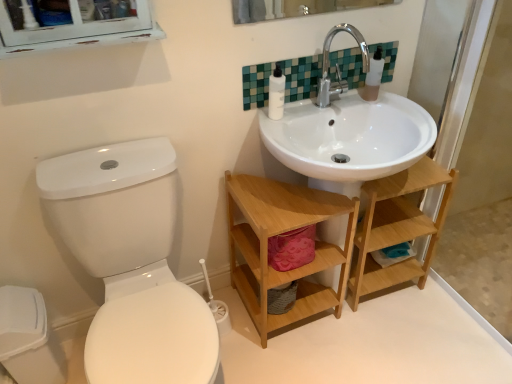
Question: From the image's perspective, would you say silver metallic faucet at upper center is shown under transparent plastic soap dispenser at upper right?

Choices:
 (A) yes
 (B) no

Answer: (A)

Question: Is silver metallic faucet at upper center bigger than transparent plastic soap dispenser at upper right?

Choices:
 (A) no
 (B) yes

Answer: (B)

Question: Can you confirm if silver metallic faucet at upper center is wider than transparent plastic soap dispenser at upper right?

Choices:
 (A) yes
 (B) no

Answer: (A)

Question: Is silver metallic faucet at upper center facing away from transparent plastic soap dispenser at upper right?

Choices:
 (A) yes
 (B) no

Answer: (B)

Question: Can we say silver metallic faucet at upper center lies outside transparent plastic soap dispenser at upper right?

Choices:
 (A) no
 (B) yes

Answer: (B)

Question: In the image, is white plastic bottle at upper center positioned in front of or behind white glossy toilet at left?

Choices:
 (A) front
 (B) behind

Answer: (B)

Question: From the image's perspective, is white plastic bottle at upper center positioned above or below white glossy toilet at left?

Choices:
 (A) below
 (B) above

Answer: (B)

Question: From a real-world perspective, relative to white glossy toilet at left, is white plastic bottle at upper center vertically above or below?

Choices:
 (A) below
 (B) above

Answer: (B)

Question: Considering the relative positions of white plastic bottle at upper center and white glossy toilet at left in the image provided, is white plastic bottle at upper center to the left or to the right of white glossy toilet at left?

Choices:
 (A) left
 (B) right

Answer: (B)

Question: From the image's perspective, relative to white plastic bottle at upper center, is green mosaic tile at upper center above or below?

Choices:
 (A) above
 (B) below

Answer: (A)

Question: Does point (291, 77) appear closer or farther from the camera than point (282, 82)?

Choices:
 (A) closer
 (B) farther

Answer: (B)

Question: Based on their positions, is green mosaic tile at upper center located to the left or right of white plastic bottle at upper center?

Choices:
 (A) left
 (B) right

Answer: (B)

Question: Is green mosaic tile at upper center in front of or behind white plastic bottle at upper center in the image?

Choices:
 (A) behind
 (B) front

Answer: (A)

Question: In the image, is white matte toilet paper at lower right on the left side or the right side of white glossy toilet at left?

Choices:
 (A) left
 (B) right

Answer: (B)

Question: From the image's perspective, is white matte toilet paper at lower right above or below white glossy toilet at left?

Choices:
 (A) below
 (B) above

Answer: (B)